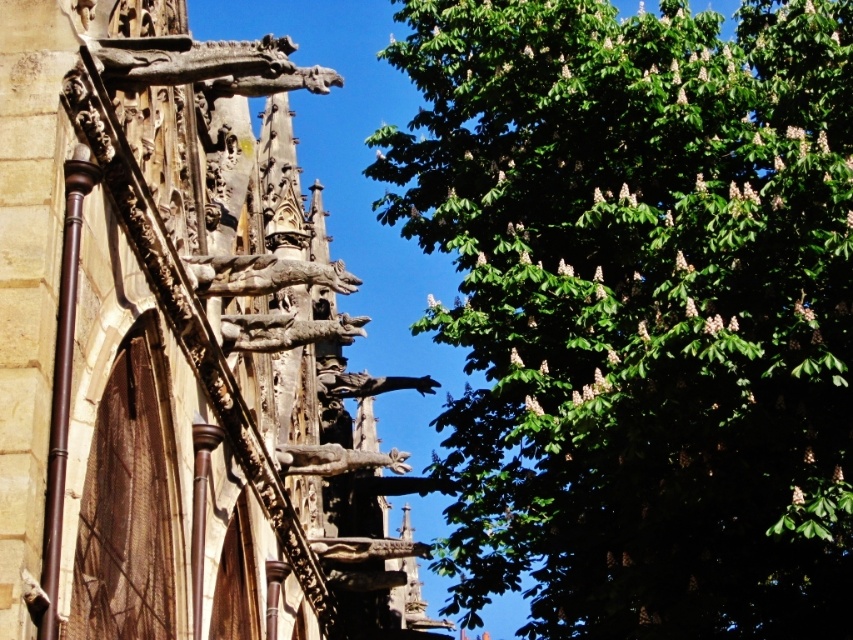
Is brown stone gargoyle at upper left to the left of rustic stone gargoyle at center from the viewer's perspective?

Yes, brown stone gargoyle at upper left is to the left of rustic stone gargoyle at center.

Does brown stone gargoyle at upper left have a greater width compared to rustic stone gargoyle at center?

No.

Which is in front, point (193, 285) or point (289, 470)?

Positioned in front is point (193, 285).

The width and height of the screenshot is (853, 640). In order to click on brown stone gargoyle at upper left in this screenshot , I will do `click(262, 275)`.

Describe the element at coordinates (169, 348) in the screenshot. This screenshot has height=640, width=853. I see `weathered stone gargoyle at upper left` at that location.

Can you confirm if weathered stone gargoyle at upper left is bigger than bronze statue at center?

Yes.

Is point (148, 193) positioned before point (370, 376)?

Yes, point (148, 193) is closer to viewer.

I want to click on weathered stone gargoyle at upper left, so click(x=169, y=348).

Does carved stone gargoyle at upper center appear under wooden gargoyle at upper center?

No.

Between point (287, 77) and point (294, 321), which one is positioned behind?

Positioned behind is point (294, 321).

Between point (247, 58) and point (335, 328), which one is positioned behind?

Positioned behind is point (335, 328).

Locate an element on the screen. This screenshot has width=853, height=640. carved stone gargoyle at upper center is located at coordinates (207, 65).